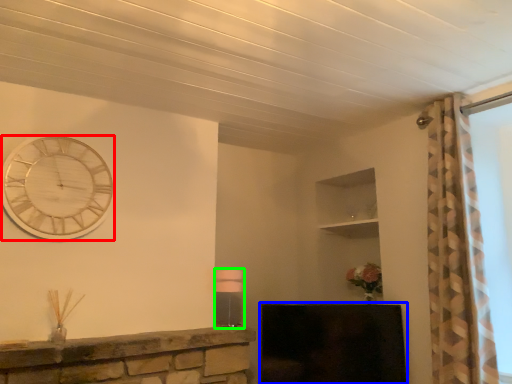
Question: Which is farther away from wall clock (highlighted by a red box)? fireplace (highlighted by a blue box) or lamp (highlighted by a green box)?

Choices:
 (A) fireplace
 (B) lamp

Answer: (A)